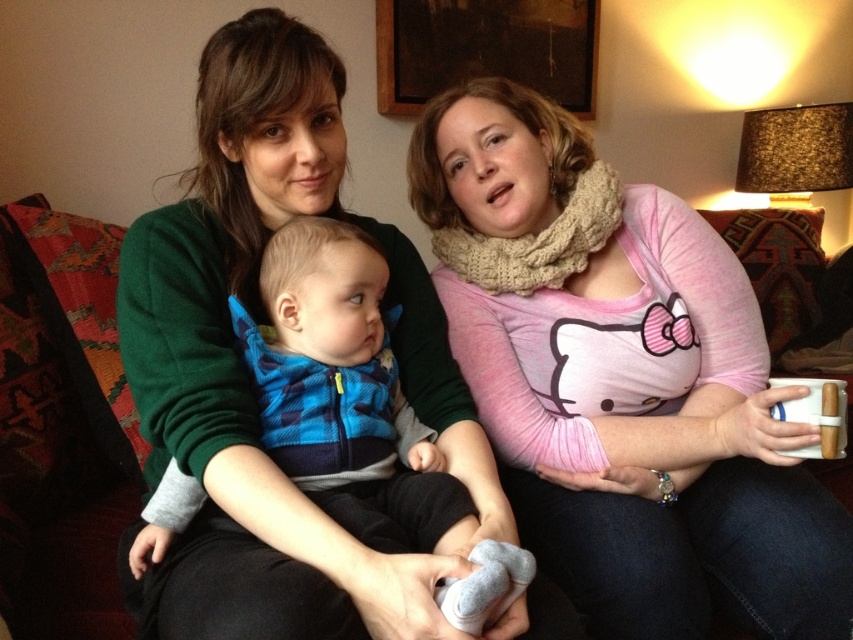
Question: Which point is closer to the camera?

Choices:
 (A) (492, 164)
 (B) (230, 484)

Answer: (B)

Question: Does pink knit scarf at upper right have a larger size compared to blue fleece vest at center?

Choices:
 (A) no
 (B) yes

Answer: (B)

Question: Where is pink knit scarf at upper right located in relation to blue fleece vest at center in the image?

Choices:
 (A) above
 (B) below

Answer: (A)

Question: Can you confirm if pink knit scarf at upper right is positioned below blue fleece vest at center?

Choices:
 (A) yes
 (B) no

Answer: (B)

Question: Among these objects, which one is farthest from the camera?

Choices:
 (A) blue fleece vest at center
 (B) pink knit scarf at upper right

Answer: (B)